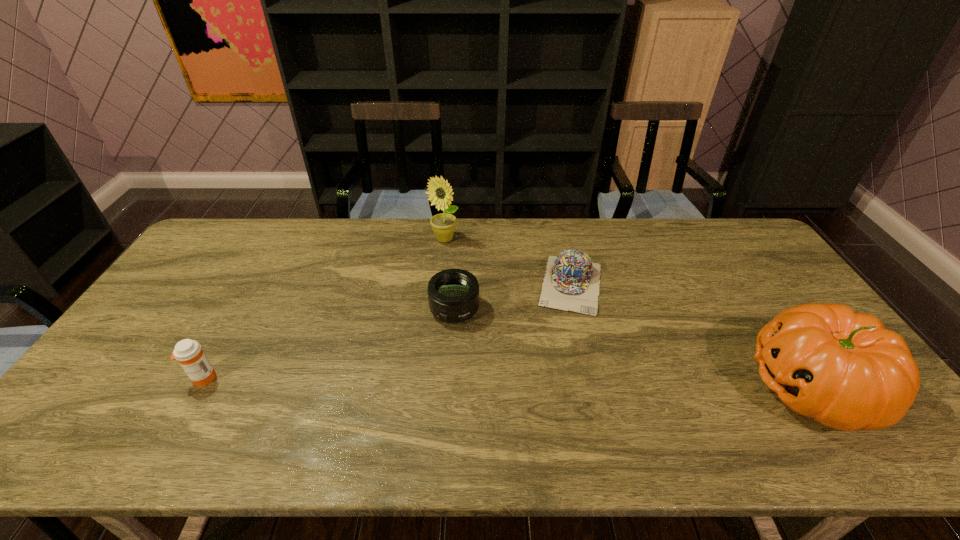
Where is `empty space between the cap and the fourth tallest object`? The image size is (960, 540). empty space between the cap and the fourth tallest object is located at coordinates (513, 297).

Where is `free area in between the shortest object and the second shortest object`? This screenshot has width=960, height=540. free area in between the shortest object and the second shortest object is located at coordinates (513, 297).

Locate an element on the screen. The width and height of the screenshot is (960, 540). object that is the fourth nearest to the farthest object is located at coordinates (844, 369).

This screenshot has height=540, width=960. I want to click on object that stands as the second closest to the leftmost object, so click(x=440, y=193).

Find the location of a particular element. The width and height of the screenshot is (960, 540). free spot that satisfies the following two spatial constraints: 1. on the back side of the medicine; 2. on the left side of the telephoto lens is located at coordinates click(x=242, y=309).

This screenshot has height=540, width=960. Find the location of `free spot that satisfies the following two spatial constraints: 1. on the front side of the farthest object; 2. on the left side of the shortest object`. free spot that satisfies the following two spatial constraints: 1. on the front side of the farthest object; 2. on the left side of the shortest object is located at coordinates (440, 284).

This screenshot has width=960, height=540. What are the coordinates of `vacant space that satisfies the following two spatial constraints: 1. on the back side of the fourth tallest object; 2. on the left side of the leftmost object` in the screenshot? It's located at (242, 309).

Identify the location of vacant space that satisfies the following two spatial constraints: 1. on the back side of the farthest object; 2. on the left side of the third tallest object. This screenshot has height=540, width=960. (282, 239).

Find the location of a particular element. free location that satisfies the following two spatial constraints: 1. on the front side of the fourth shortest object; 2. on the carved face of the shortest object is located at coordinates (595, 386).